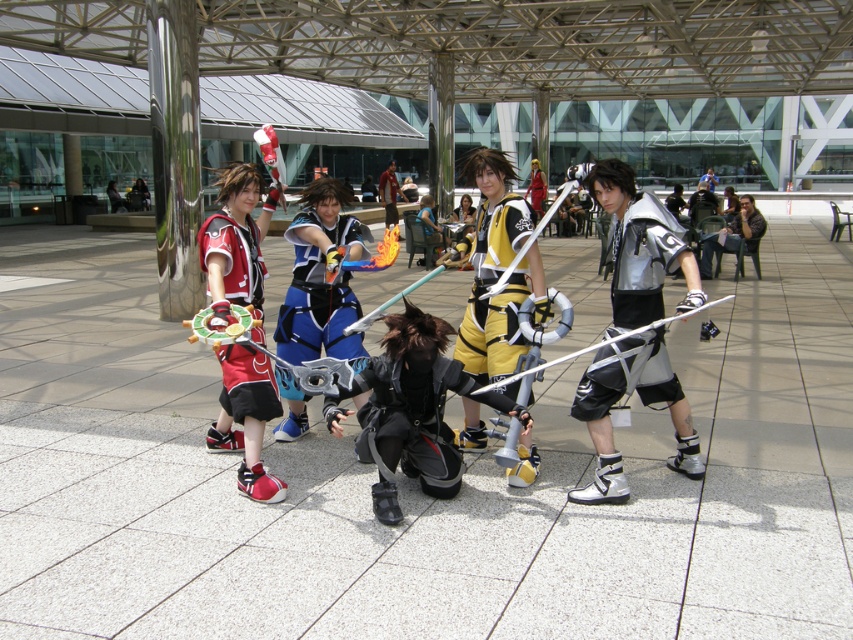
Question: Which of the following is the closest to the observer?

Choices:
 (A) blue fabric sword at center
 (B) silver metallic armor at center
 (C) matte red fabric at left
 (D) shiny silver sword at center

Answer: (B)

Question: Among these objects, which one is farthest from the camera?

Choices:
 (A) silver metallic armor at center
 (B) black matte armor at center

Answer: (B)

Question: Estimate the real-world distances between objects in this image. Which object is closer to the yellow matte shorts at center?

Choices:
 (A) dark brown leather jacket at center
 (B) silver metallic armor at center

Answer: (B)

Question: Can you confirm if black matte armor at center is positioned to the right of dark brown leather jacket at center?

Choices:
 (A) no
 (B) yes

Answer: (A)

Question: Does matte red fabric at left lie in front of blue fabric sword at center?

Choices:
 (A) yes
 (B) no

Answer: (A)

Question: Considering the relative positions of black matte armor at center and blue fabric sword at center in the image provided, where is black matte armor at center located with respect to blue fabric sword at center?

Choices:
 (A) right
 (B) left

Answer: (A)